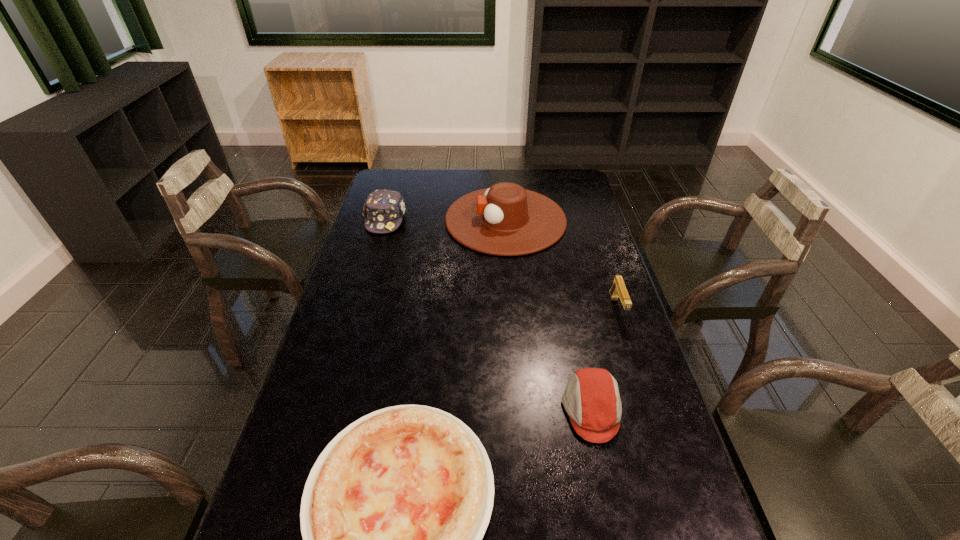
Identify the location of free space at the far edge of the desktop. (452, 190).

The image size is (960, 540). In the image, there is a desktop. Identify the location of free space at the left edge. (361, 253).

Where is `vacant space at the right edge`? The width and height of the screenshot is (960, 540). vacant space at the right edge is located at coordinates (588, 221).

At what (x,y) coordinates should I click in order to perform the action: click on empty space that is in between the pistol and the shorter cap. Please return your answer as a coordinate pair (x, y). Looking at the image, I should click on coord(604,359).

Where is `free area in between the farther cap and the nearer cap`? The height and width of the screenshot is (540, 960). free area in between the farther cap and the nearer cap is located at coordinates (489, 314).

Locate an element on the screen. vacant point located between the shorter cap and the tallest object is located at coordinates (548, 315).

Identify the location of vacant space that's between the left cap and the pistol. (501, 264).

The height and width of the screenshot is (540, 960). Identify the location of free space between the cowboy hat and the shorter cap. (548, 315).

At what (x,y) coordinates should I click in order to perform the action: click on vacant region between the cowboy hat and the shorter cap. Please return your answer as a coordinate pair (x, y). Image resolution: width=960 pixels, height=540 pixels. Looking at the image, I should click on (548, 315).

I want to click on object that is the closest to the third farthest object, so click(591, 399).